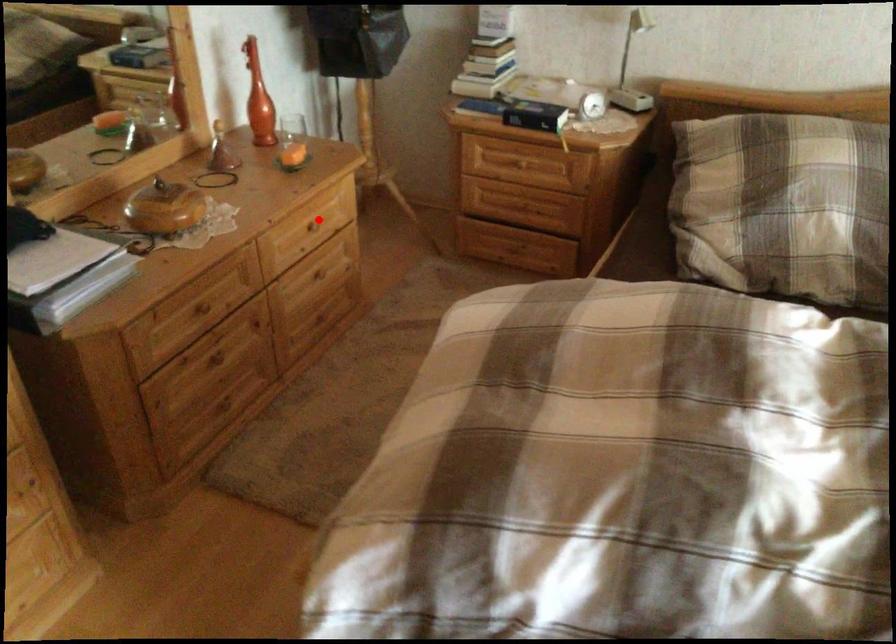
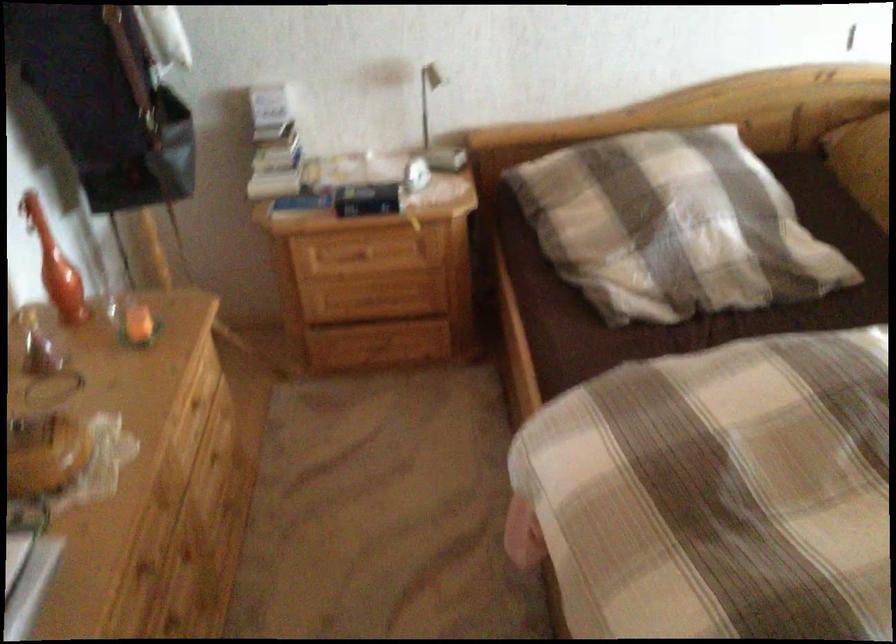
Find the pixel in the second image that matches the highlighted location in the first image.

(200, 395)